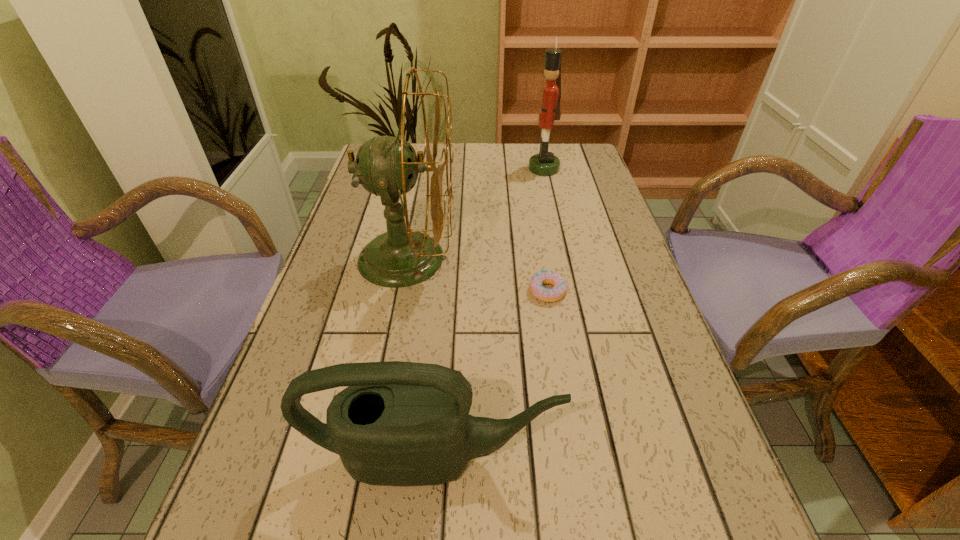
You are a GUI agent. You are given a task and a screenshot of the screen. Output one action in this format:
    pyautogui.click(x=<x>, y=<y>)
    Task: Click on the fan
    
    Given the screenshot: What is the action you would take?
    pyautogui.click(x=385, y=166)

Locate an element on the screen. This screenshot has height=540, width=960. nutcracker is located at coordinates (545, 163).

Find the location of a particular element. The width and height of the screenshot is (960, 540). watering can is located at coordinates (397, 423).

This screenshot has height=540, width=960. I want to click on the nearest object, so click(x=397, y=423).

Where is `the shortest object`? Image resolution: width=960 pixels, height=540 pixels. the shortest object is located at coordinates point(541,293).

Where is `vacant region located 0.180m in front of the fan, directing air flow`? vacant region located 0.180m in front of the fan, directing air flow is located at coordinates coord(529,258).

Locate an element on the screen. The height and width of the screenshot is (540, 960). vacant position located 0.360m on the front-facing side of the farthest object is located at coordinates (415, 168).

This screenshot has width=960, height=540. In order to click on free spot located 0.360m on the front-facing side of the farthest object in this screenshot , I will do `click(415, 168)`.

Locate an element on the screen. free space located on the front-facing side of the farthest object is located at coordinates (500, 168).

I want to click on vacant space located 0.390m on the front of the shortest object, so click(581, 491).